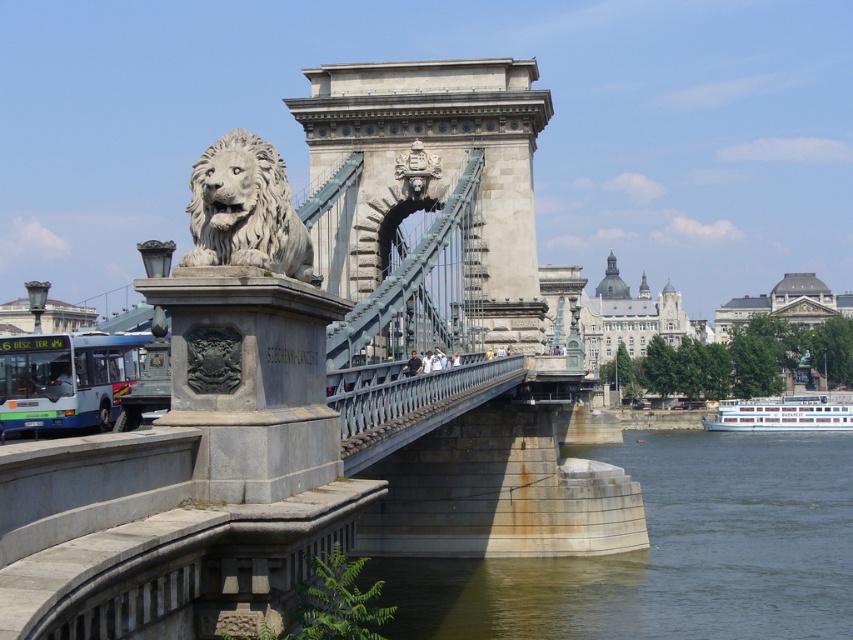
Question: In this image, where is stone suspension bridge at center located relative to white stone lion at upper left?

Choices:
 (A) above
 (B) below

Answer: (B)

Question: Is stone suspension bridge at center bigger than white stone lion at upper left?

Choices:
 (A) yes
 (B) no

Answer: (A)

Question: Can you confirm if stone suspension bridge at center is bigger than white stone lion at upper left?

Choices:
 (A) yes
 (B) no

Answer: (A)